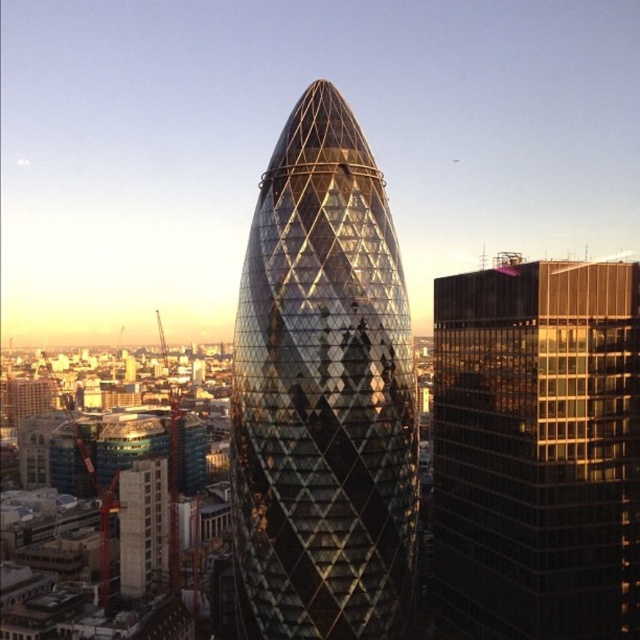
Is shiny glass tower at center thinner than black glass building at right?

No, shiny glass tower at center is not thinner than black glass building at right.

Between point (291, 324) and point (509, 500), which one is positioned in front?

Point (291, 324) is more forward.

This screenshot has width=640, height=640. Find the location of `shiny glass tower at center`. shiny glass tower at center is located at coordinates (323, 394).